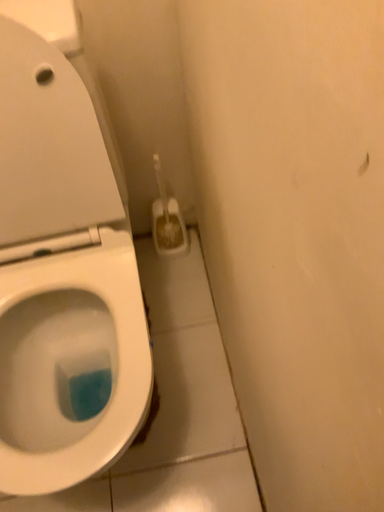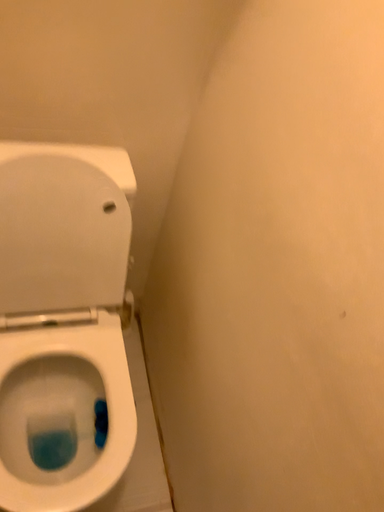
Question: Which way did the camera rotate in the video?

Choices:
 (A) rotated left
 (B) rotated right

Answer: (B)